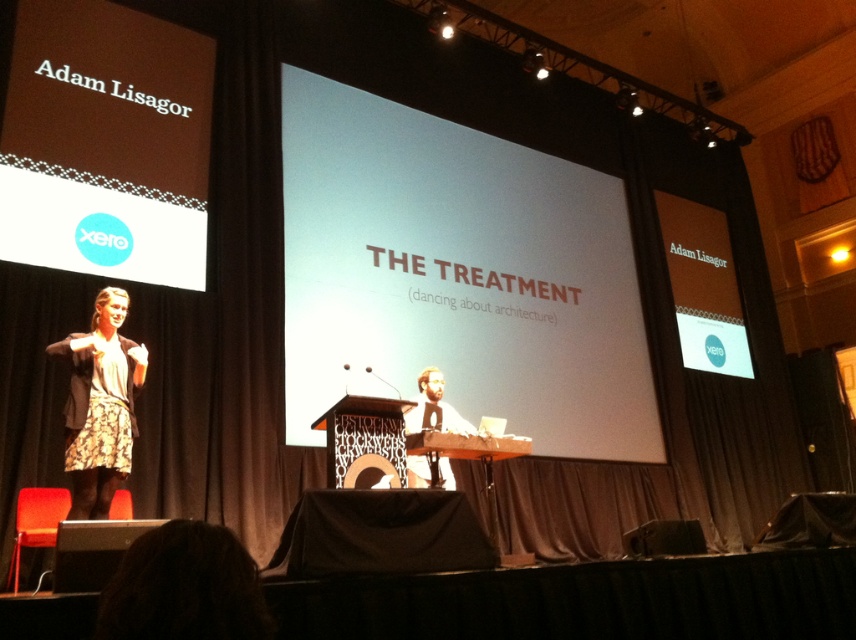
Question: Does white matte projection screen at center appear on the right side of light brown wood podium at center?

Choices:
 (A) yes
 (B) no

Answer: (A)

Question: Is brown floral dress at left to the right of light brown wood podium at center from the viewer's perspective?

Choices:
 (A) yes
 (B) no

Answer: (B)

Question: Which object is positioned closest to the brown floral dress at left?

Choices:
 (A) white matte projection screen at center
 (B) light brown wood podium at center

Answer: (B)

Question: Is white matte projection screen at center thinner than brown floral dress at left?

Choices:
 (A) yes
 (B) no

Answer: (B)

Question: Based on their relative distances, which object is nearer to the light brown wood podium at center?

Choices:
 (A) white matte projection screen at center
 (B) brown floral dress at left

Answer: (B)

Question: Which of the following is the closest to the observer?

Choices:
 (A) (461, 422)
 (B) (68, 461)
 (C) (461, 412)

Answer: (B)